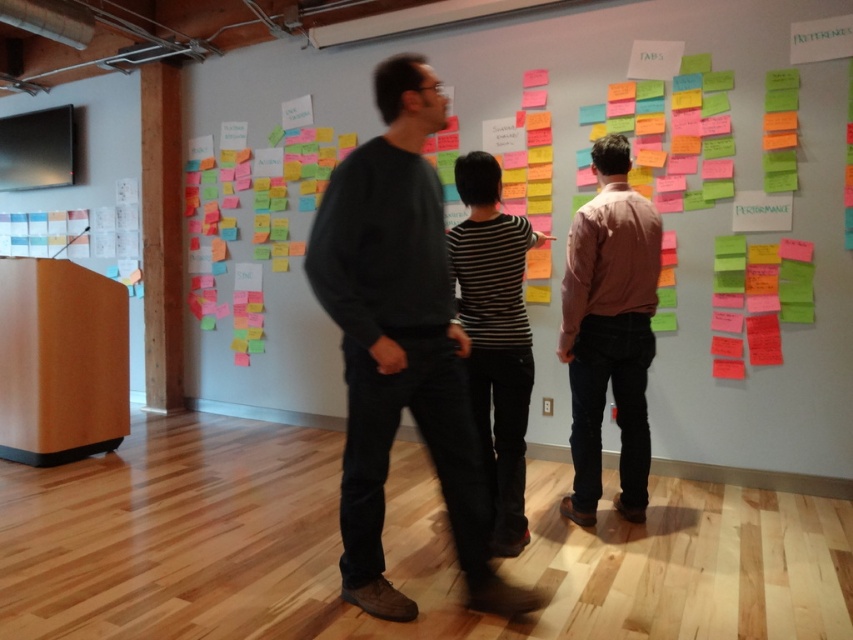
Question: Which of the following is the closest to the observer?

Choices:
 (A) multicolored sticky notes at center
 (B) dark gray sweater at center

Answer: (B)

Question: Does dark gray sweater at center have a lesser width compared to pink cotton shirt at center?

Choices:
 (A) no
 (B) yes

Answer: (A)

Question: Is dark gray sweater at center wider than pink cotton shirt at center?

Choices:
 (A) yes
 (B) no

Answer: (A)

Question: Which of the following is the farthest from the observer?

Choices:
 (A) pink cotton shirt at center
 (B) multicolored sticky notes at center
 (C) dark gray sweater at center

Answer: (B)

Question: Does dark gray sweater at center appear over pink cotton shirt at center?

Choices:
 (A) no
 (B) yes

Answer: (A)

Question: Which is farther from the pink cotton shirt at center?

Choices:
 (A) dark gray sweater at center
 (B) multicolored sticky notes at center

Answer: (B)